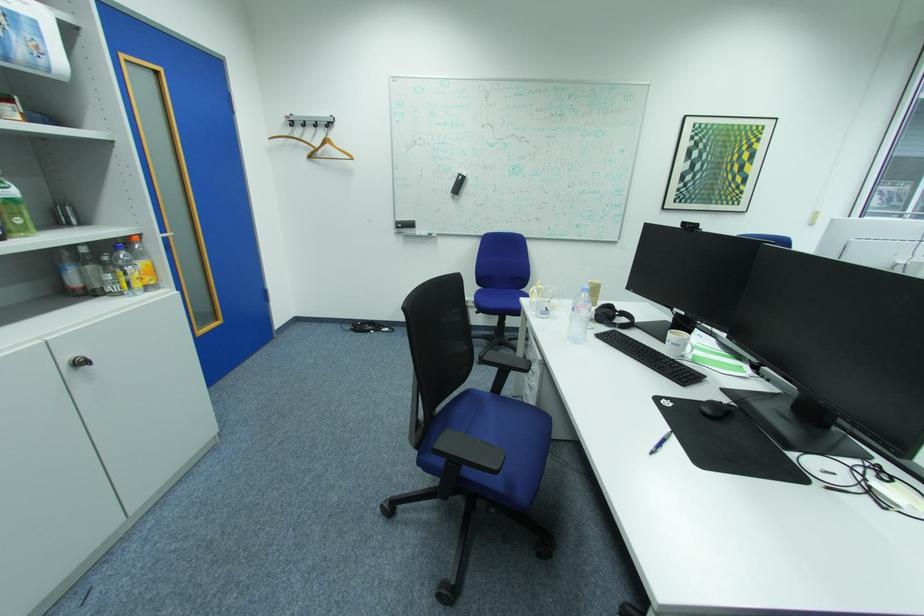
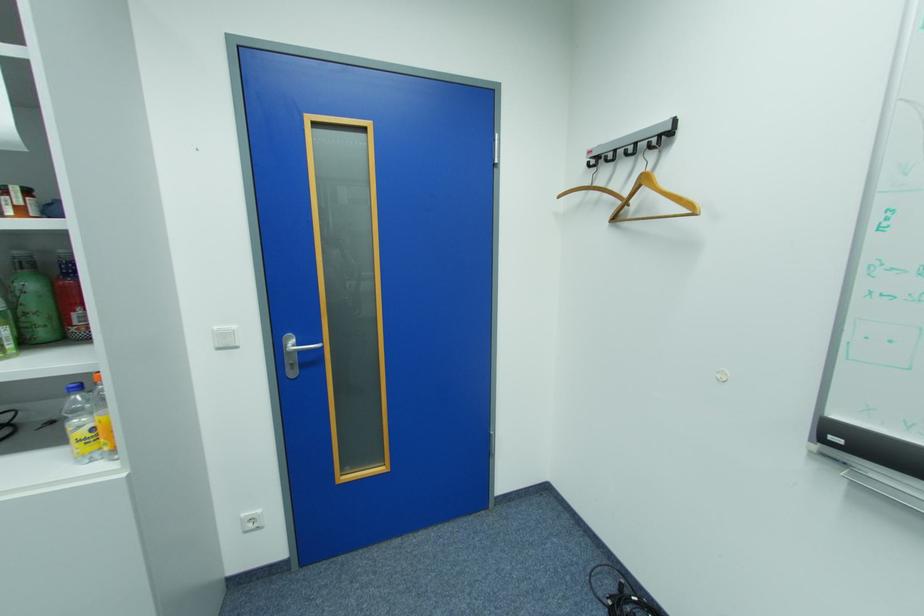
Where in the second image is the point corresponding to (301,122) from the first image?

(606, 159)